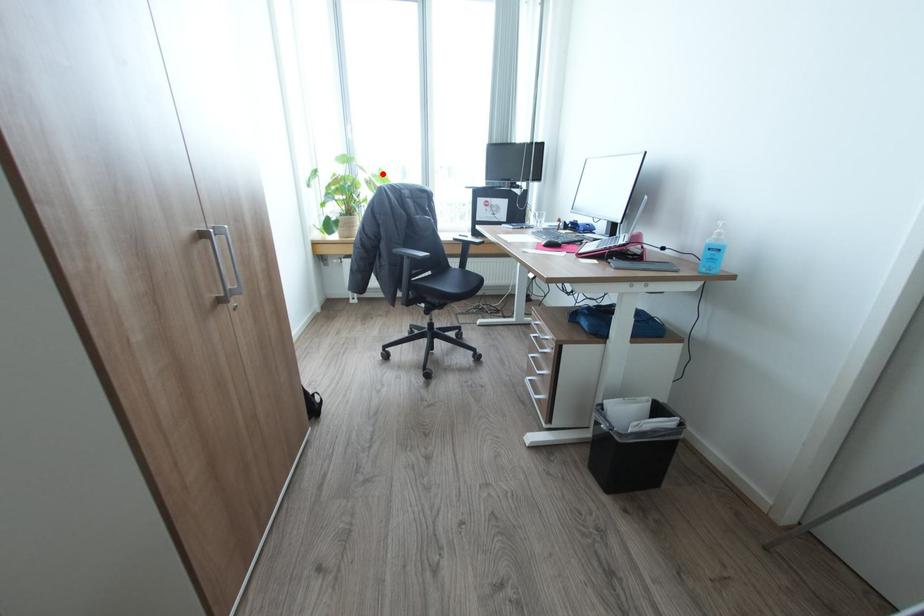
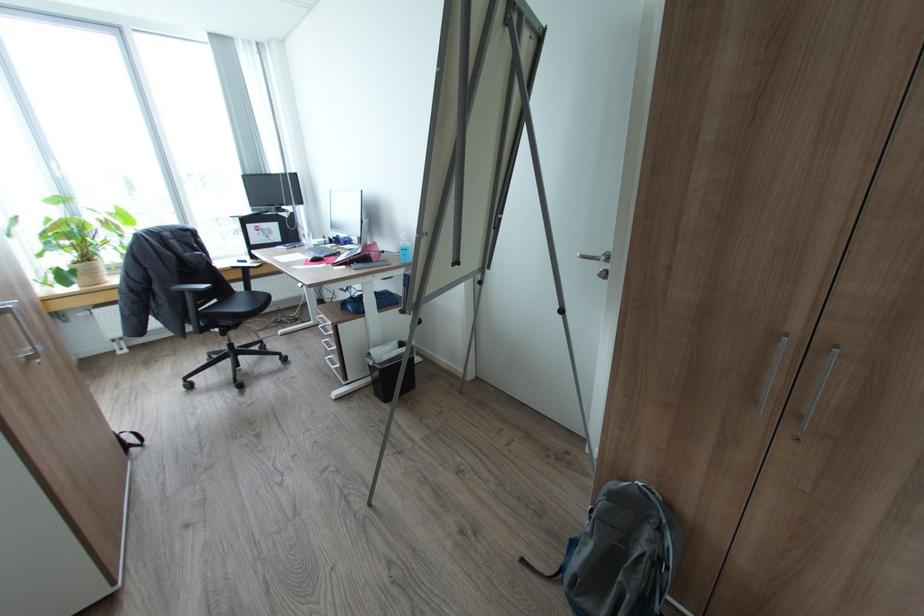
Find the pixel in the second image that matches the highlighted location in the first image.

(119, 211)